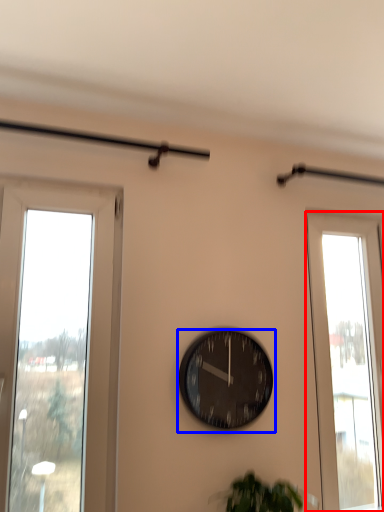
Question: Among these objects, which one is farthest to the camera, window (highlighted by a red box) or wall clock (highlighted by a blue box)?

Choices:
 (A) window
 (B) wall clock

Answer: (A)